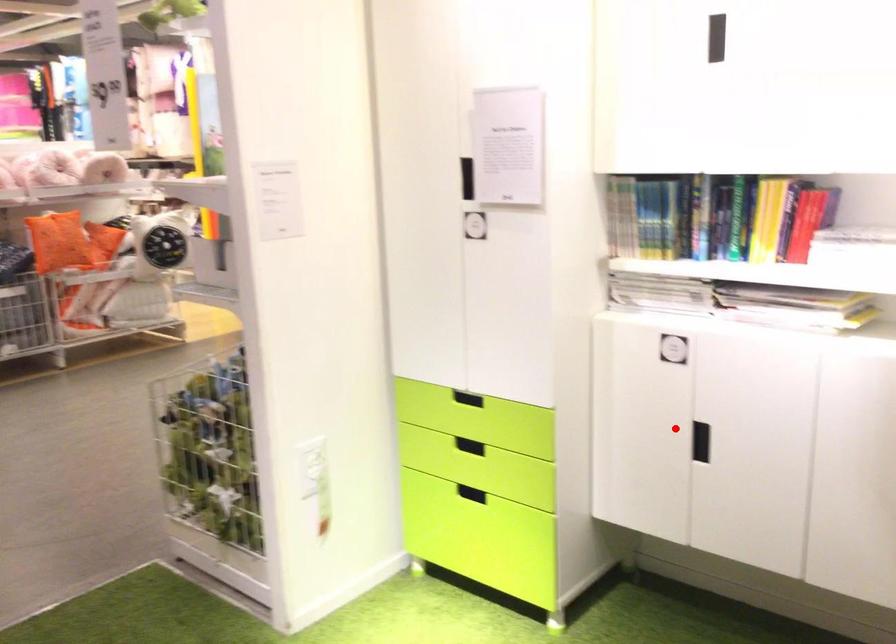
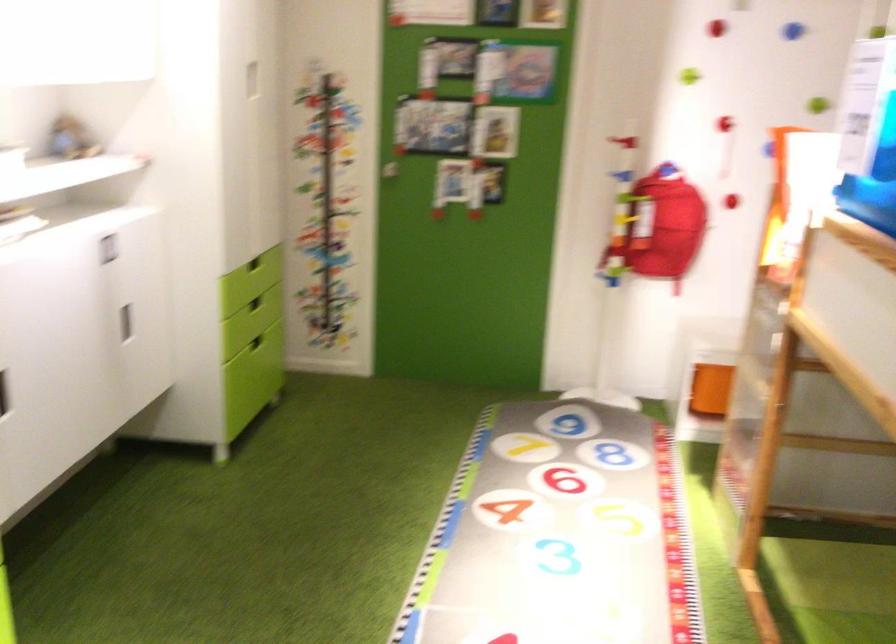
Question: I am providing you with two images of the same scene from different viewpoints. In image1, a red point is highlighted. Considering the same 3D point in image2, which of the following is correct?

Choices:
 (A) It is closer
 (B) It is farther

Answer: (A)